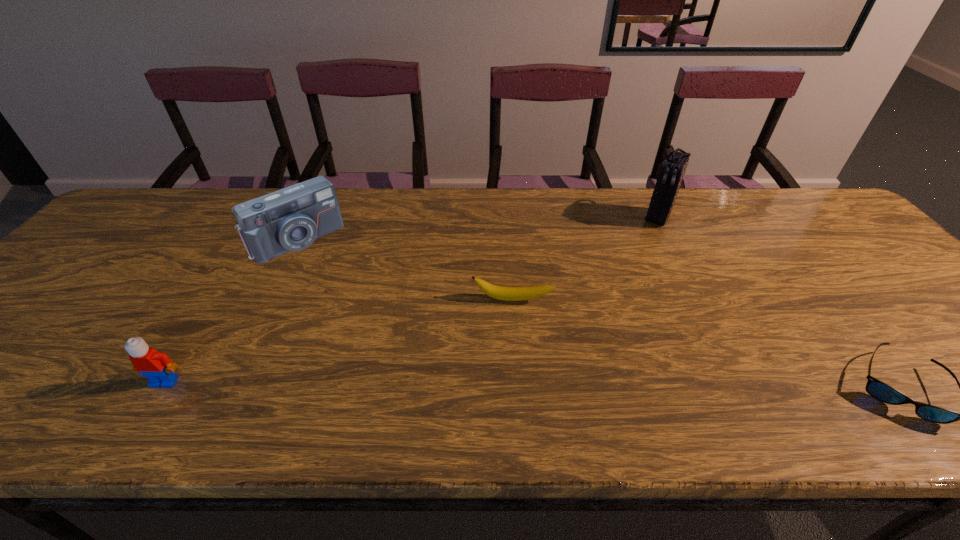
Image resolution: width=960 pixels, height=540 pixels. I want to click on vacant space located with the zip open on the fourth object from left to right, so click(647, 238).

At what (x,y) coordinates should I click in order to perform the action: click on free space located with the zip open on the fourth object from left to right. Please return your answer as a coordinate pair (x, y). The width and height of the screenshot is (960, 540). Looking at the image, I should click on (641, 247).

Where is `free space located 0.110m on the upward curve of the second shortest object`? free space located 0.110m on the upward curve of the second shortest object is located at coordinates (506, 341).

Locate an element on the screen. The width and height of the screenshot is (960, 540). vacant space located on the upward curve of the second shortest object is located at coordinates (508, 327).

Find the location of a particular element. Image resolution: width=960 pixels, height=540 pixels. vacant position located 0.130m on the upward curve of the second shortest object is located at coordinates (506, 348).

Where is `camera present at the far edge`? Image resolution: width=960 pixels, height=540 pixels. camera present at the far edge is located at coordinates (291, 219).

Find the location of a particular element. This screenshot has width=960, height=540. clutch bag that is at the far edge is located at coordinates (672, 170).

Locate an element on the screen. The image size is (960, 540). object that is at the near edge is located at coordinates (157, 367).

In the image, there is a desktop. Identify the location of vacant area at the far edge. The image size is (960, 540). (350, 222).

You are a GUI agent. You are given a task and a screenshot of the screen. Output one action in this format:
    pyautogui.click(x=<x>, y=<y>)
    Task: Click on the vacant space at the near edge of the desktop
    Image resolution: width=960 pixels, height=540 pixels.
    Given the screenshot: What is the action you would take?
    pyautogui.click(x=391, y=369)